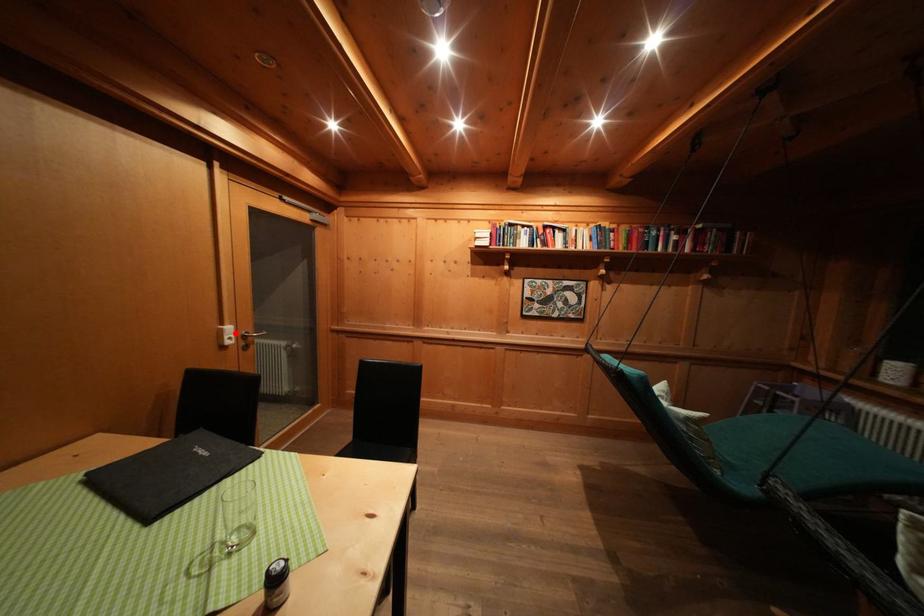
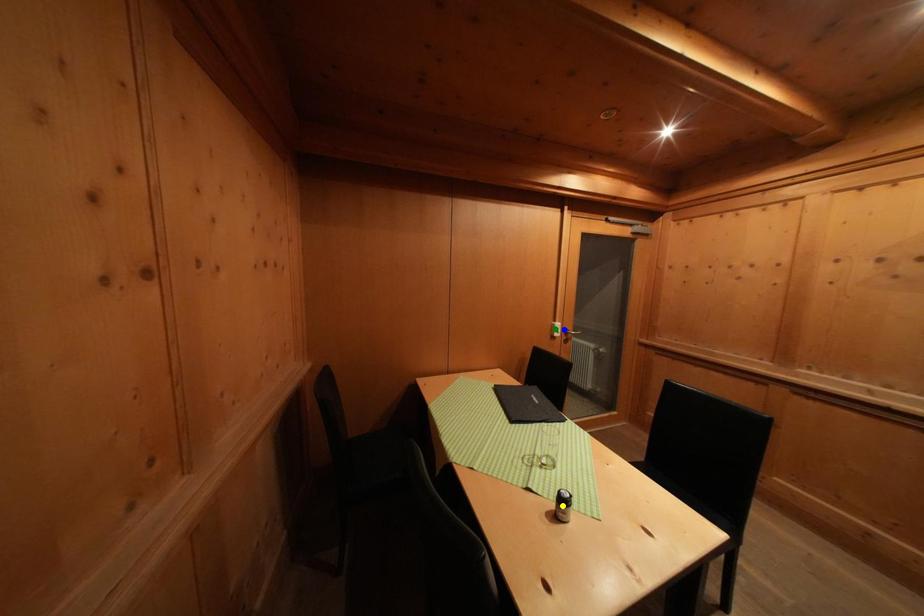
Question: I am providing you with two images of the same scene from different viewpoints. A red point is marked on the first image. You are given multiple points on the second image. Which mark in image 2 goes with the point in image 1?

Choices:
 (A) green point
 (B) yellow point
 (C) blue point

Answer: (C)